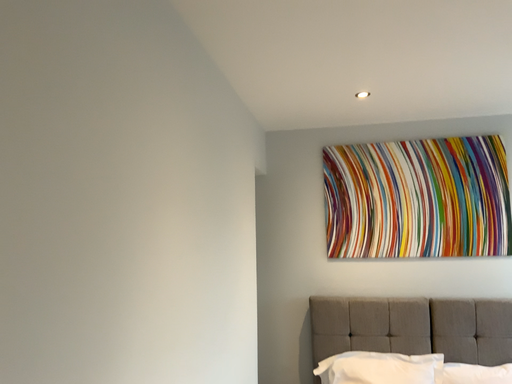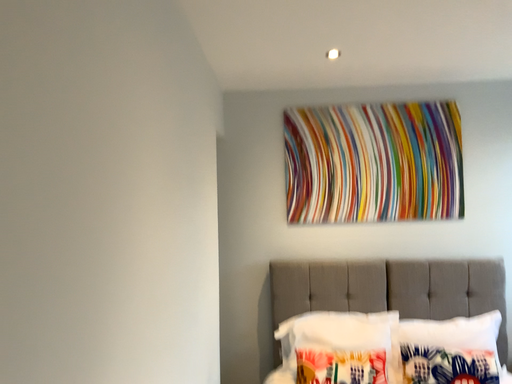
Question: How did the camera likely rotate when shooting the video?

Choices:
 (A) rotated left
 (B) rotated right

Answer: (B)